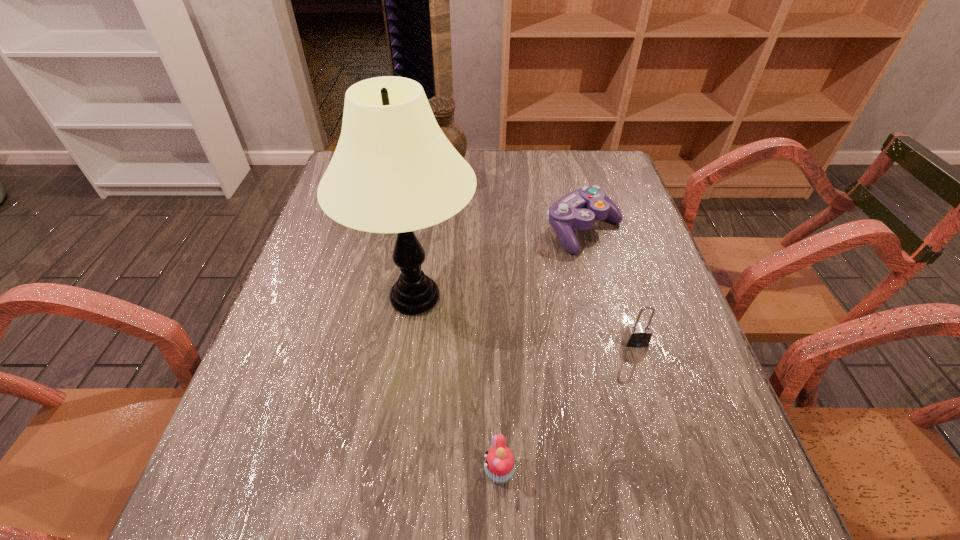
Where is `free space between the padlock and the control`? This screenshot has height=540, width=960. free space between the padlock and the control is located at coordinates (610, 286).

At what (x,y) coordinates should I click in order to perform the action: click on free space that is in between the tallest object and the padlock. Please return your answer as a coordinate pair (x, y). This screenshot has height=540, width=960. Looking at the image, I should click on (525, 320).

The image size is (960, 540). What are the coordinates of `free space between the cupcake and the padlock` in the screenshot? It's located at point(567,407).

Where is `free spot between the pitcher and the nearest object`? free spot between the pitcher and the nearest object is located at coordinates (470, 323).

Identify the location of free space between the padlock and the farthest object. The height and width of the screenshot is (540, 960). tap(539, 259).

At what (x,y) coordinates should I click in order to perform the action: click on object that stands as the closest to the third object from right to left. Please return your answer as a coordinate pair (x, y). This screenshot has width=960, height=540. Looking at the image, I should click on (393, 171).

You are a GUI agent. You are given a task and a screenshot of the screen. Output one action in this format:
    pyautogui.click(x=<x>, y=<y>)
    Task: Click on the closest object to the cupcake
    
    Given the screenshot: What is the action you would take?
    [x=393, y=171]

The width and height of the screenshot is (960, 540). What are the coordinates of `free space that satisfies the following two spatial constraints: 1. on the front side of the control; 2. on the face of the cupcake` in the screenshot? It's located at (647, 471).